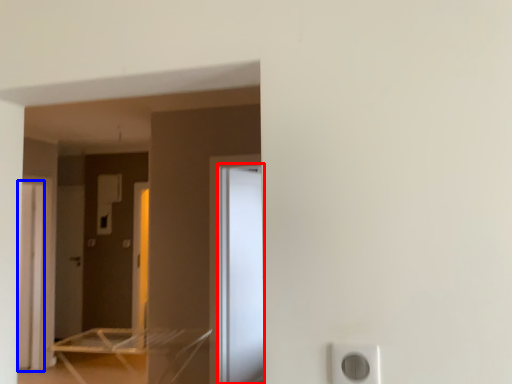
Question: Which of the following is the closest to the observer, screen door (highlighted by a red box) or screen door (highlighted by a blue box)?

Choices:
 (A) screen door
 (B) screen door

Answer: (A)